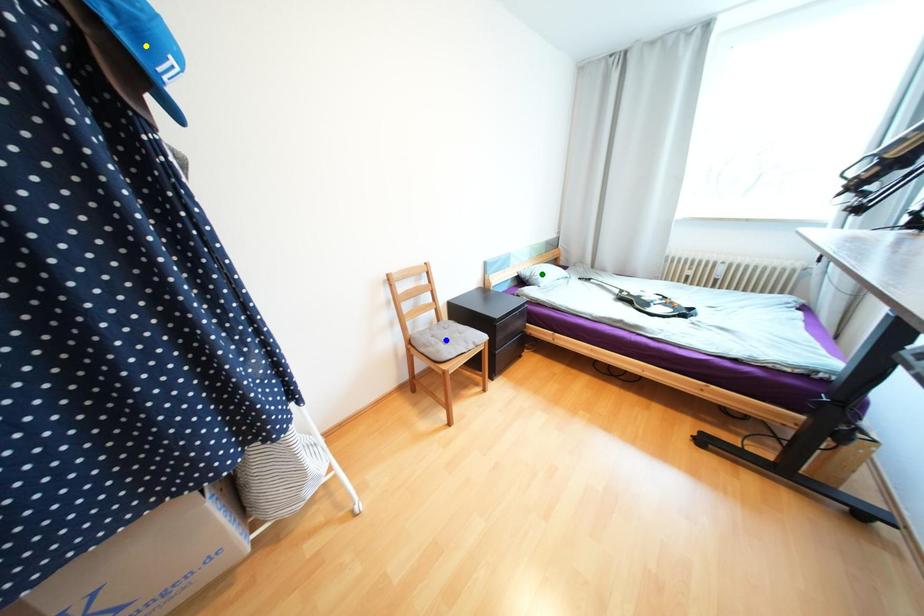
Order these from nearest to farthest:
green point
yellow point
blue point

yellow point → blue point → green point